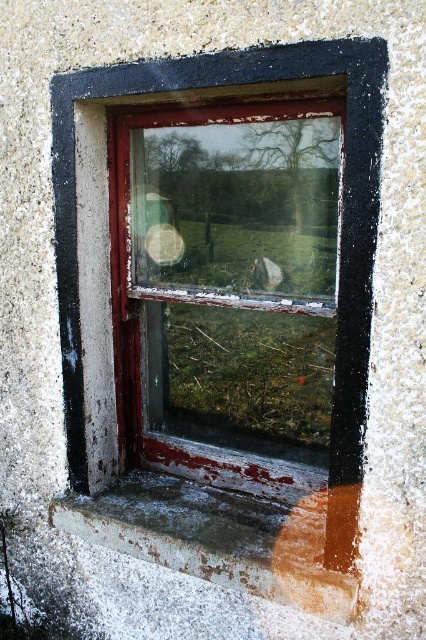
Can you confirm if rusty glass window at center is positioned to the right of brown wood at lower right?

In fact, rusty glass window at center is to the left of brown wood at lower right.

Is rusty glass window at center in front of brown wood at lower right?

Yes, rusty glass window at center is in front of brown wood at lower right.

Is point (273, 470) behind point (299, 596)?

That is True.

Image resolution: width=426 pixels, height=640 pixels. What are the coordinates of `rusty glass window at center` in the screenshot? It's located at (229, 285).

Which of these two, rusty glass window at center or rusty concrete window sill at lower center, stands shorter?

Standing shorter between the two is rusty concrete window sill at lower center.

Can you confirm if rusty glass window at center is positioned to the right of rusty concrete window sill at lower center?

Correct, you'll find rusty glass window at center to the right of rusty concrete window sill at lower center.

Does point (287, 269) lie behind point (150, 534)?

No, (287, 269) is in front of (150, 534).

The image size is (426, 640). In order to click on rusty glass window at center in this screenshot , I will do `click(229, 285)`.

Does rusty concrete window sill at lower center appear under brown wood at lower right?

No.

Which is in front, point (333, 595) or point (305, 516)?

Point (333, 595)

This screenshot has height=640, width=426. In order to click on rusty concrete window sill at lower center in this screenshot , I will do `click(227, 536)`.